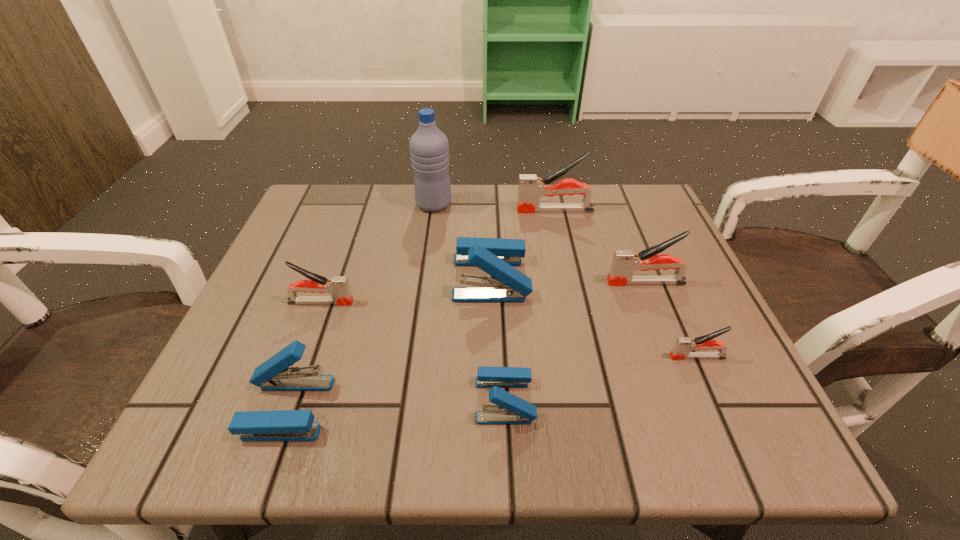
Find the location of a particular element. The image size is (960, 540). water bottle is located at coordinates (429, 148).

At what (x,y) coordinates should I click in order to perform the action: click on the third object from left to right. Please return your answer as a coordinate pair (x, y). The height and width of the screenshot is (540, 960). Looking at the image, I should click on (429, 148).

Find the location of a particular element. The height and width of the screenshot is (540, 960). the biggest gray stapler is located at coordinates (531, 188).

I want to click on the farthest stapler, so click(531, 188).

Find the location of a particular element. the second farthest gray stapler is located at coordinates pos(625,262).

Where is `the biggest blue stapler`? Image resolution: width=960 pixels, height=540 pixels. the biggest blue stapler is located at coordinates (495, 256).

At what (x,y) coordinates should I click in order to perform the action: click on the leftmost gray stapler. Please return your answer as a coordinate pair (x, y). The width and height of the screenshot is (960, 540). Looking at the image, I should click on (338, 286).

Find the location of a particular element. The height and width of the screenshot is (540, 960). the third farthest gray stapler is located at coordinates click(338, 286).

The height and width of the screenshot is (540, 960). In order to click on the leftmost blue stapler in this screenshot , I will do `click(273, 375)`.

Identify the location of the third nearest stapler. (683, 345).